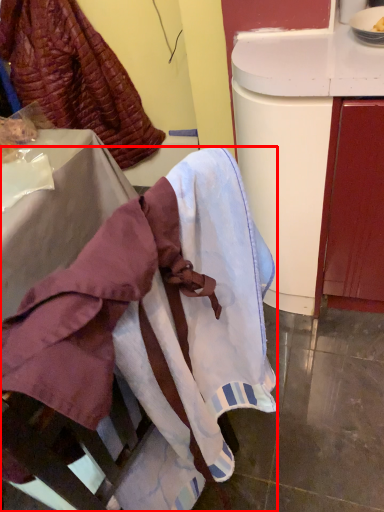
Question: From the image's perspective, considering the relative positions of furniture (annotated by the red box) and leftover in the image provided, where is furniture (annotated by the red box) located with respect to the staircase?

Choices:
 (A) above
 (B) below

Answer: (B)